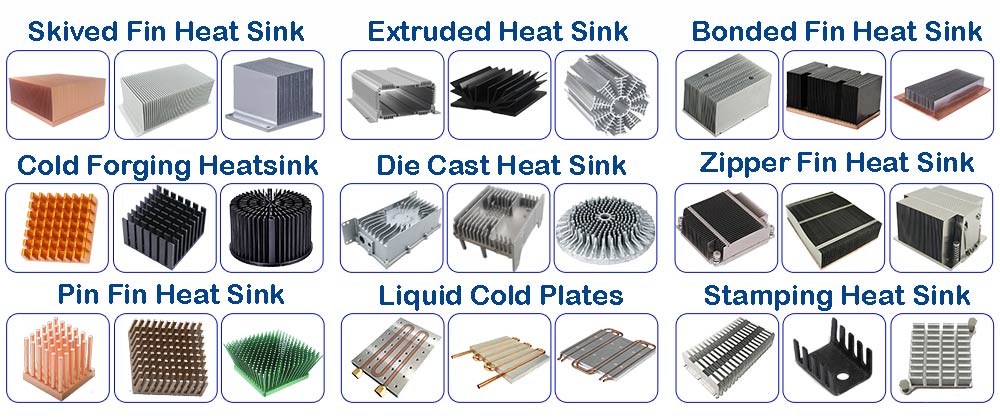
Identify the location of stand. The image size is (1000, 420). (846, 354).